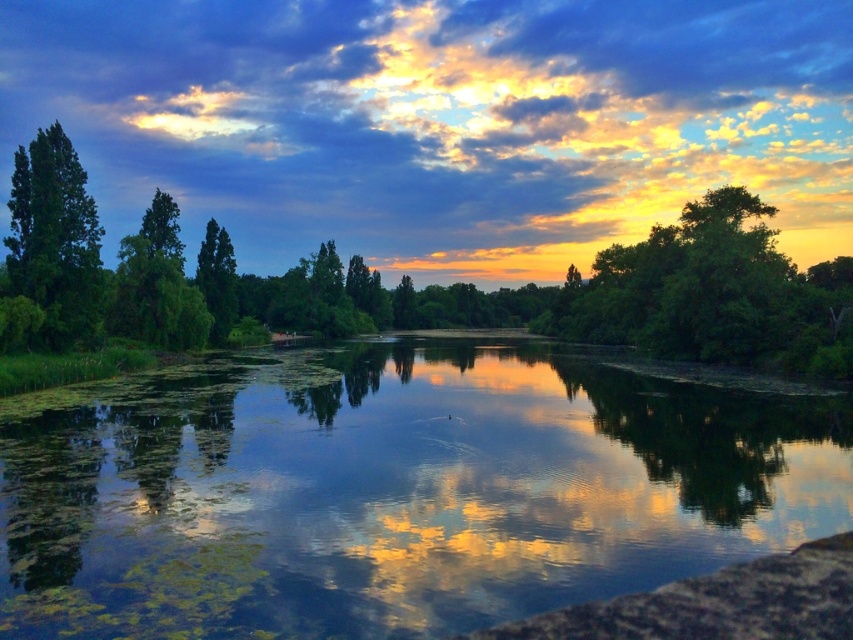
Locate an element on the screen. This screenshot has width=853, height=640. green leafy tree at center is located at coordinates (584, 296).

Which is more to the left, green leafy tree at center or green leafy tree at right?

green leafy tree at center is more to the left.

Who is more distant from viewer, (15, 241) or (840, 321)?

The point (15, 241) is behind.

What are the coordinates of `green leafy tree at center` in the screenshot? It's located at (584, 296).

Can you confirm if green leafy tree at right is taller than green matte tree at left?

In fact, green leafy tree at right may be shorter than green matte tree at left.

Measure the distance between green leafy tree at right and camera.

green leafy tree at right is 45.30 meters from camera.

You are a GUI agent. You are given a task and a screenshot of the screen. Output one action in this format:
    pyautogui.click(x=<x>, y=<y>)
    Task: Click on the green leafy tree at right
    
    Given the screenshot: What is the action you would take?
    pyautogui.click(x=712, y=294)

Can you confirm if green leafy tree at center is positioned below green matte tree at left?

No.

Is point (827, 317) farther from camera compared to point (84, 285)?

No, (827, 317) is in front of (84, 285).

Locate an element on the screen. green leafy tree at center is located at coordinates (584, 296).

Where is `green leafy tree at center`? The image size is (853, 640). green leafy tree at center is located at coordinates (584, 296).